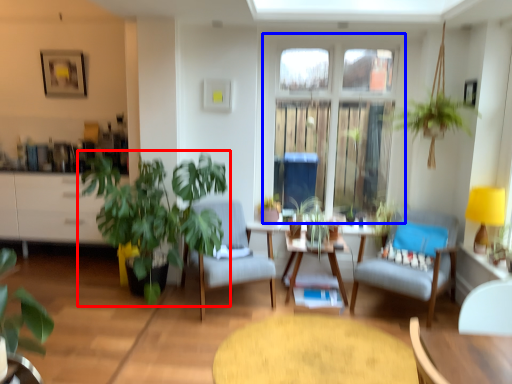
Question: Which of the following is the closest to the observer, houseplant (highlighted by a red box) or window (highlighted by a blue box)?

Choices:
 (A) houseplant
 (B) window

Answer: (A)